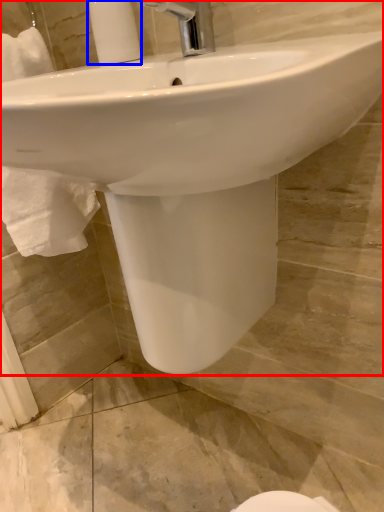
Question: Which object is closer to the camera taking this photo, sink (highlighted by a red box) or soap dispenser (highlighted by a blue box)?

Choices:
 (A) sink
 (B) soap dispenser

Answer: (A)